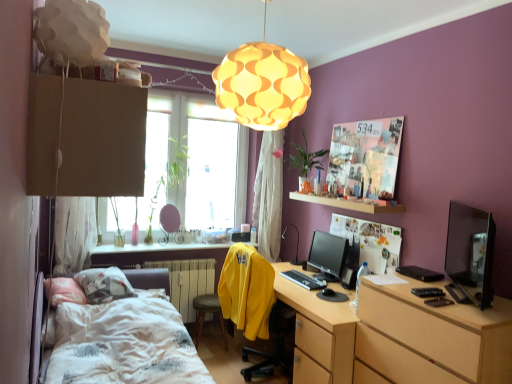
Identify the location of vacant space in black matte keyboard at center (from a real-world perspective). (303, 275).